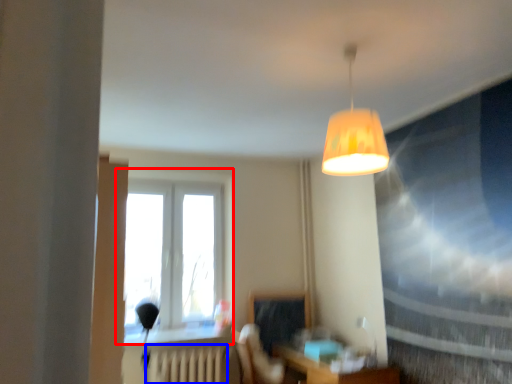
Question: Which point is closer to the camera, window (highlighted by a red box) or radiator (highlighted by a blue box)?

Choices:
 (A) window
 (B) radiator

Answer: (B)